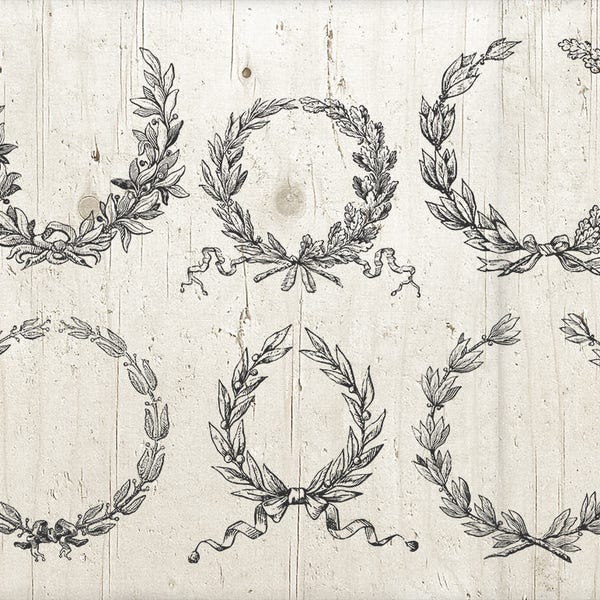
Where is `ends of ribbon on first wreath top row`? ends of ribbon on first wreath top row is located at coordinates (10, 252), (18, 255), (93, 254), (102, 247).